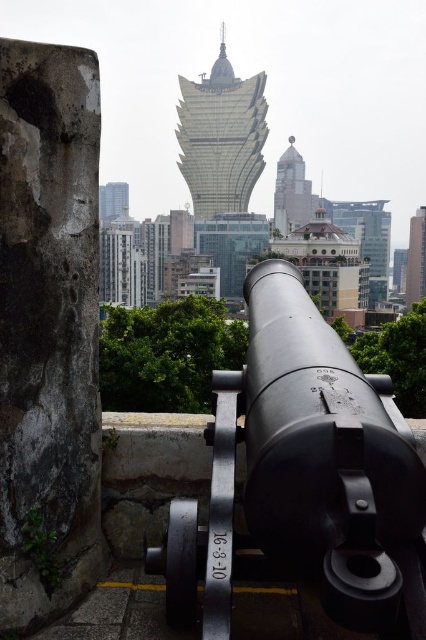
Question: Is smooth gray tower at center thinner than metallic glass tower at right?

Choices:
 (A) yes
 (B) no

Answer: (B)

Question: Which object is the closest to the black matte cannon at center?

Choices:
 (A) smooth gray tower at center
 (B) metallic glass tower at right

Answer: (A)

Question: From the image, what is the correct spatial relationship of black matte cannon at center in relation to smooth gray tower at center?

Choices:
 (A) right
 (B) left

Answer: (B)

Question: Which point appears closest to the camera in this image?

Choices:
 (A) (288, 506)
 (B) (250, 125)

Answer: (A)

Question: Considering the real-world distances, which object is closest to the smooth gray tower at center?

Choices:
 (A) black matte cannon at center
 (B) gold glass tower at center

Answer: (B)

Question: Is black matte cannon at center positioned in front of smooth gray tower at center?

Choices:
 (A) no
 (B) yes

Answer: (B)